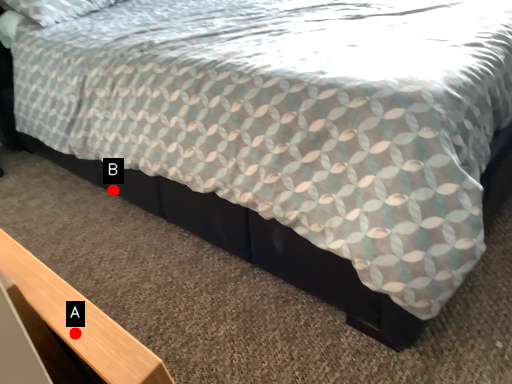
Question: Two points are circled on the image, labeled by A and B beside each circle. Which point is further to the camera?

Choices:
 (A) A is further
 (B) B is further

Answer: (B)